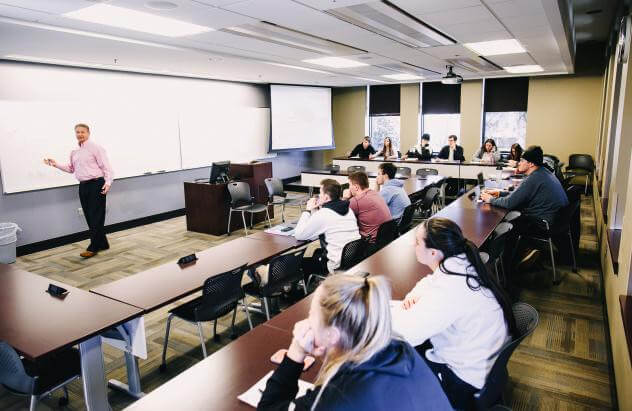
This screenshot has height=411, width=632. I want to click on desks, so click(x=64, y=323), click(x=158, y=280), click(x=296, y=220), click(x=416, y=179), click(x=341, y=167), click(x=494, y=184), click(x=473, y=233), click(x=406, y=281), click(x=272, y=354).